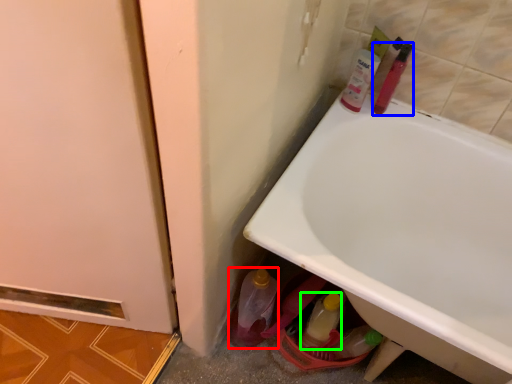
Question: Considering the real-world distances, which object is farthest from bottle (highlighted by a red box)? mouthwash (highlighted by a blue box) or bottle (highlighted by a green box)?

Choices:
 (A) mouthwash
 (B) bottle

Answer: (A)